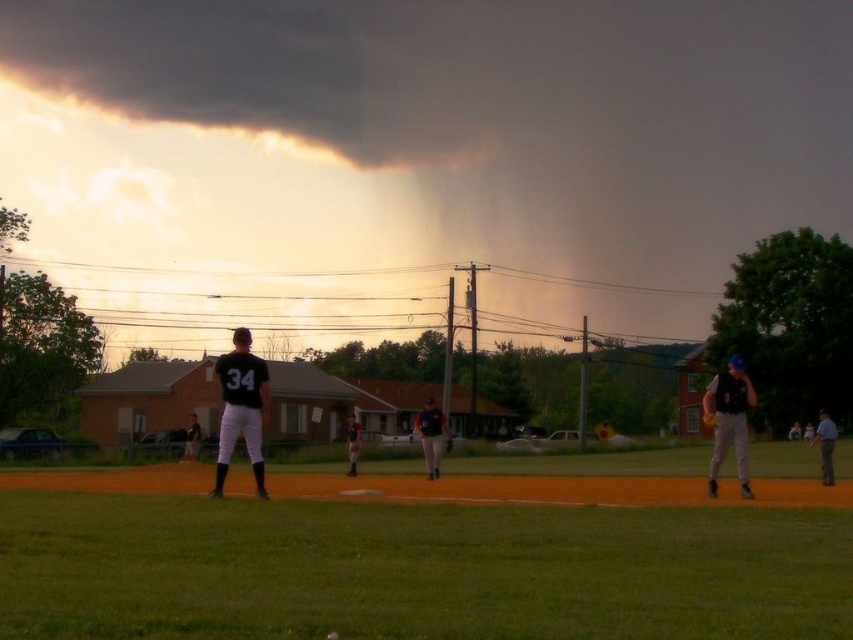
Question: Among these objects, which one is nearest to the camera?

Choices:
 (A) matte black baseball glove at center
 (B) black jersey at center
 (C) matte black vest at right
 (D) dark gray uniform at center

Answer: (B)

Question: Among these points, which one is nearest to the camera?

Choices:
 (A) (260, 376)
 (B) (312, 70)
 (C) (436, 456)

Answer: (A)

Question: Is black jersey at center positioned in front of matte black baseball glove at center?

Choices:
 (A) no
 (B) yes

Answer: (B)

Question: Can you confirm if dark gray uniform at center is thinner than gray uniform at right?

Choices:
 (A) yes
 (B) no

Answer: (A)

Question: Does dark gray cloud at upper center appear on the right side of matte black baseball glove at center?

Choices:
 (A) no
 (B) yes

Answer: (B)

Question: Among these points, which one is nearest to the camera?

Choices:
 (A) (347, 435)
 (B) (189, 449)
 (C) (434, 412)

Answer: (C)